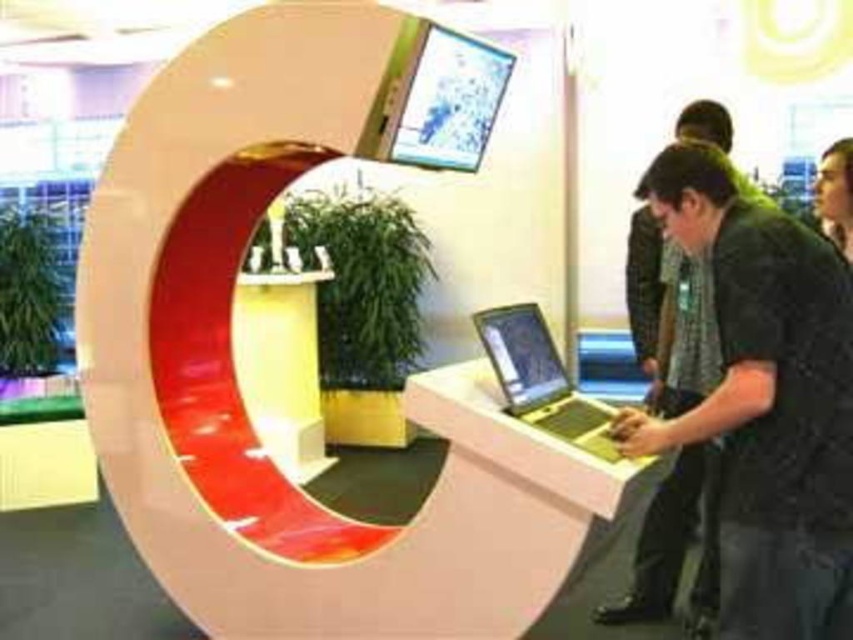
Between black textured shirt at center and white plastic information desk at center, which one is positioned lower?

white plastic information desk at center

Is point (851, 461) farther from viewer compared to point (573, 547)?

That is False.

Describe the element at coordinates (764, 401) in the screenshot. This screenshot has height=640, width=853. I see `black textured shirt at center` at that location.

Where is `black textured shirt at center`? The width and height of the screenshot is (853, 640). black textured shirt at center is located at coordinates (764, 401).

Is white plastic information desk at center taller than silver metallic laptop at center?

Indeed, white plastic information desk at center has a greater height compared to silver metallic laptop at center.

How far apart are white plastic information desk at center and silver metallic laptop at center?

white plastic information desk at center is 9.89 inches from silver metallic laptop at center.

Identify the location of white plastic information desk at center. This screenshot has height=640, width=853. (505, 508).

Can you confirm if yellow matte/soft plastic at center is wider than silver metallic laptop at center?

Indeed, yellow matte/soft plastic at center has a greater width compared to silver metallic laptop at center.

Which is above, yellow matte/soft plastic at center or silver metallic laptop at center?

silver metallic laptop at center is above.

Between point (247, 296) and point (543, 371), which one is positioned behind?

The point (247, 296) is behind.

Where is `yellow matte/soft plastic at center`? The height and width of the screenshot is (640, 853). yellow matte/soft plastic at center is located at coordinates (281, 365).